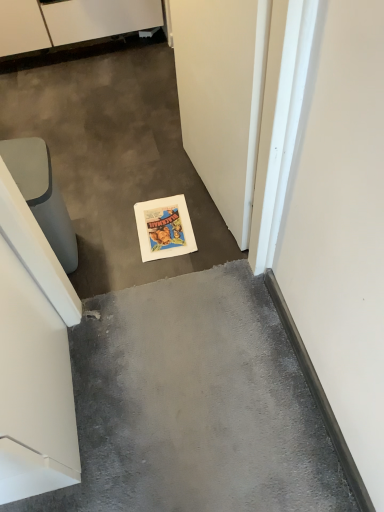
What is the approximate width of matte gray trash can at left?

It is 12.42 inches.

What do you see at coordinates (42, 194) in the screenshot? I see `matte gray trash can at left` at bounding box center [42, 194].

Describe the element at coordinates (71, 22) in the screenshot. The image size is (384, 512). I see `white glossy cabinet at upper left` at that location.

Image resolution: width=384 pixels, height=512 pixels. I want to click on white matte door at lower center, so click(222, 97).

Locate an element on the screen. Image resolution: width=384 pixels, height=512 pixels. matte gray trash can at left is located at coordinates (42, 194).

Which object is more forward, white glossy cabinet at upper left or matte gray trash can at left?

Positioned in front is matte gray trash can at left.

Is point (5, 17) closer to viewer compared to point (14, 150)?

No, (5, 17) is behind (14, 150).

Is white glossy cabinet at upper left to the left of matte gray trash can at left from the viewer's perspective?

Yes, white glossy cabinet at upper left is to the left of matte gray trash can at left.

Is white glossy cabinet at upper left touching matte gray trash can at left?

white glossy cabinet at upper left is not next to matte gray trash can at left, and they're not touching.

Find the location of `door on the right of matte gray trash can at left`. door on the right of matte gray trash can at left is located at coordinates [222, 97].

Does matte gray trash can at left have a lesser width compared to white matte door at lower center?

No.

Is matte gray trash can at left oriented away from white matte door at lower center?

No, matte gray trash can at left is not facing away from white matte door at lower center.

From the image's perspective, which is below, matte gray trash can at left or white matte door at lower center?

matte gray trash can at left is shown below in the image.

Is white matte door at lower center wider than white glossy cabinet at upper left?

No, white matte door at lower center is not wider than white glossy cabinet at upper left.

You are a GUI agent. You are given a task and a screenshot of the screen. Output one action in this format:
    pyautogui.click(x=<x>, y=<y>)
    Task: Click on the door located above the white glossy cabinet at upper left (from a real-world perspective)
    The width and height of the screenshot is (384, 512).
    Given the screenshot: What is the action you would take?
    pyautogui.click(x=222, y=97)

Considering their positions, is white matte door at lower center located in front of or behind white glossy cabinet at upper left?

white matte door at lower center is positioned closer to the viewer than white glossy cabinet at upper left.

Which of these two, matte gray trash can at left or white glossy cabinet at upper left, stands shorter?

With less height is white glossy cabinet at upper left.

Find the location of `furniture on the right of the white glossy cabinet at upper left`. furniture on the right of the white glossy cabinet at upper left is located at coordinates (42, 194).

Could you tell me if matte gray trash can at left is turned towards white glossy cabinet at upper left?

No.

Considering the sizes of objects white matte door at lower center and matte gray trash can at left in the image provided, who is taller, white matte door at lower center or matte gray trash can at left?

white matte door at lower center is taller.

From the image's perspective, which one is positioned lower, white matte door at lower center or matte gray trash can at left?

matte gray trash can at left is shown below in the image.

Between white matte door at lower center and matte gray trash can at left, which one has larger width?

matte gray trash can at left.

Considering the relative positions of white matte door at lower center and matte gray trash can at left in the image provided, is white matte door at lower center behind matte gray trash can at left?

No, white matte door at lower center is closer to the camera.

From a real-world perspective, which is physically below, white glossy cabinet at upper left or white matte door at lower center?

white glossy cabinet at upper left.

Which is more to the left, white glossy cabinet at upper left or white matte door at lower center?

white glossy cabinet at upper left is more to the left.

Is white glossy cabinet at upper left bigger than white matte door at lower center?

Yes, white glossy cabinet at upper left is bigger than white matte door at lower center.

Identify the location of cabinetry that is under the matte gray trash can at left (from a real-world perspective). (71, 22).

Locate an element on the screen. door positioned vertically above the matte gray trash can at left (from a real-world perspective) is located at coordinates (222, 97).

Which object lies nearer to the anchor point white matte door at lower center, matte gray trash can at left or white glossy cabinet at upper left?

Based on the image, matte gray trash can at left appears to be nearer to white matte door at lower center.

From the image, which object appears to be nearer to white matte door at lower center, white glossy cabinet at upper left or matte gray trash can at left?

matte gray trash can at left is closer to white matte door at lower center.

Considering their positions, is white matte door at lower center positioned closer to matte gray trash can at left than white glossy cabinet at upper left?

The object closer to matte gray trash can at left is white matte door at lower center.

Looking at the image, which one is located further to white glossy cabinet at upper left, matte gray trash can at left or white matte door at lower center?

Among the two, white matte door at lower center is located further to white glossy cabinet at upper left.

Which object lies nearer to the anchor point white glossy cabinet at upper left, white matte door at lower center or matte gray trash can at left?

Among the two, matte gray trash can at left is located nearer to white glossy cabinet at upper left.

Which object lies further to the anchor point matte gray trash can at left, white glossy cabinet at upper left or white matte door at lower center?

white glossy cabinet at upper left is positioned further to the anchor matte gray trash can at left.

The width and height of the screenshot is (384, 512). Identify the location of door between white glossy cabinet at upper left and matte gray trash can at left from top to bottom. (222, 97).